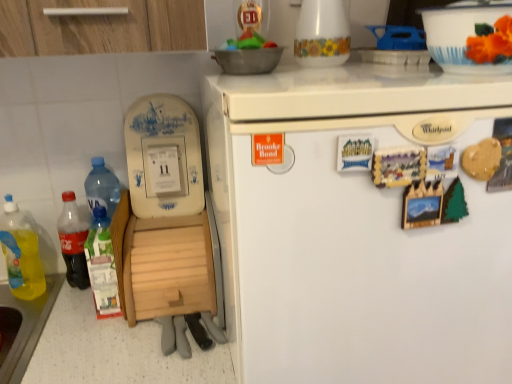
Question: Considering the positions of point (460, 48) and point (66, 230), is point (460, 48) closer or farther from the camera than point (66, 230)?

Choices:
 (A) farther
 (B) closer

Answer: (B)

Question: Is white glossy bowl at upper right to the left or to the right of translucent plastic soda bottle at left, the second bottle viewed from the left, in the image?

Choices:
 (A) left
 (B) right

Answer: (B)

Question: Which of these objects is positioned closest to the white ceramic vase at upper center?

Choices:
 (A) white matte refrigerator at upper right
 (B) translucent plastic bottle at lower left, arranged as the first bottle when viewed from the right
 (C) white glossy bowl at upper right
 (D) translucent plastic soda bottle at left, marked as the second bottle in a right-to-left arrangement
 (E) wooden at left

Answer: (C)

Question: Considering the real-world distances, which object is farthest from the white glossy bowl at upper right?

Choices:
 (A) translucent plastic soda bottle at left, marked as the second bottle in a right-to-left arrangement
 (B) translucent plastic bottle at lower left, placed as the 3th bottle when sorted from left to right
 (C) white ceramic vase at upper center
 (D) wooden at left
 (E) yellow translucent liquid at lower left, positioned as the first bottle in left-to-right order

Answer: (E)